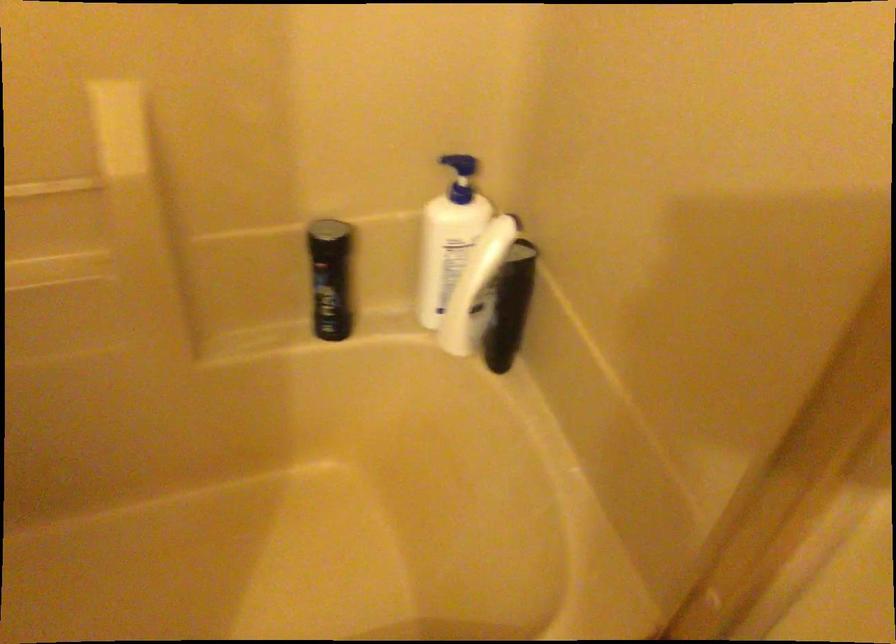
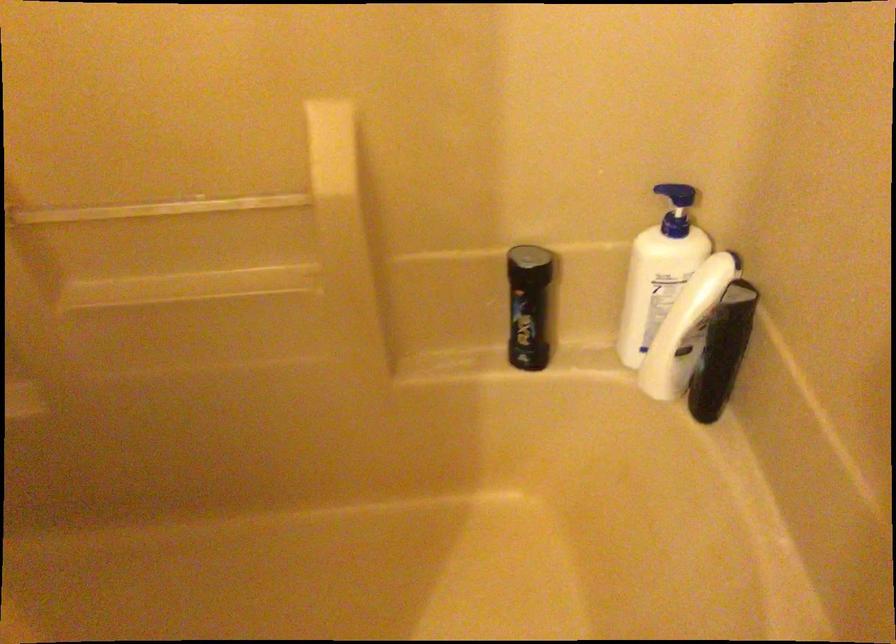
Question: Which direction would the cameraman need to move to produce the second image? Reply with the corresponding letter.

Choices:
 (A) Left
 (B) Right
 (C) Forward
 (D) Backward

Answer: (C)